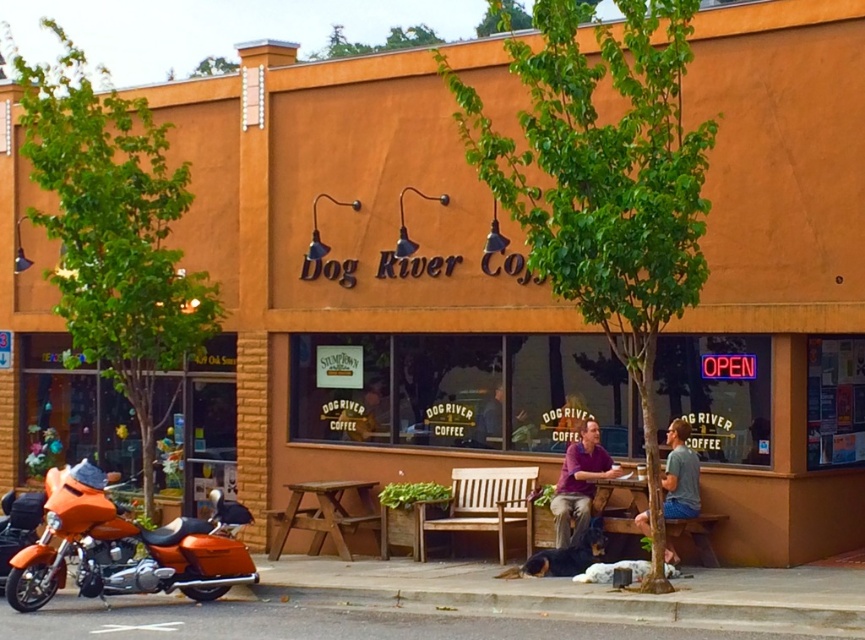
Is purple matte shirt at center shorter than gray cotton shirt at right?

In fact, purple matte shirt at center may be taller than gray cotton shirt at right.

Is purple matte shirt at center thinner than gray cotton shirt at right?

No, purple matte shirt at center is not thinner than gray cotton shirt at right.

Who is more distant from viewer, (577, 499) or (689, 429)?

The point (577, 499) is more distant.

The image size is (865, 640). Identify the location of purple matte shirt at center. (580, 483).

Can you confirm if light brown wooden bench at center is positioned below purple matte shirt at center?

Yes.

Does light brown wooden bench at center have a lesser width compared to purple matte shirt at center?

Incorrect, light brown wooden bench at center's width is not less than purple matte shirt at center's.

Between point (462, 484) and point (594, 490), which one is positioned behind?

Point (462, 484)

Locate an element on the screen. This screenshot has height=640, width=865. light brown wooden bench at center is located at coordinates (484, 504).

Who is shorter, orange matte motorcycle at lower left or light brown wooden bench at center?

With less height is light brown wooden bench at center.

Is orange matte motorcycle at lower left wider than light brown wooden bench at center?

Yes, orange matte motorcycle at lower left is wider than light brown wooden bench at center.

Is point (75, 577) less distant than point (481, 470)?

Yes.

Find the location of `orange matte motorcycle at lower left`. orange matte motorcycle at lower left is located at coordinates (126, 547).